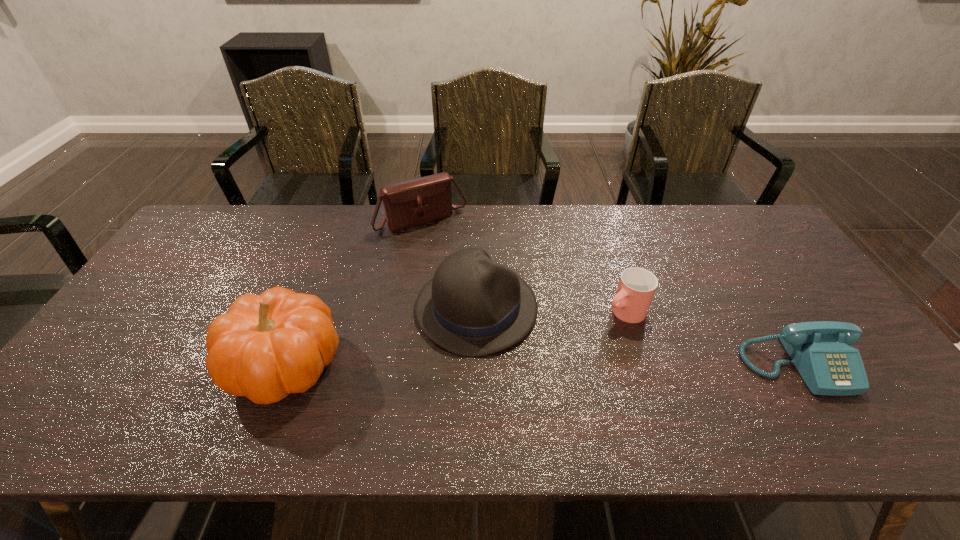
This screenshot has width=960, height=540. Find the location of `object situated at the near right corner`. object situated at the near right corner is located at coordinates (820, 350).

The width and height of the screenshot is (960, 540). I want to click on free region at the far edge of the desktop, so click(251, 225).

The height and width of the screenshot is (540, 960). I want to click on free space at the near edge of the desktop, so pos(577,371).

Where is `vacant space at the left edge of the desktop`? The image size is (960, 540). vacant space at the left edge of the desktop is located at coordinates (174, 259).

This screenshot has width=960, height=540. Identify the location of vacant space at the right edge of the desktop. (788, 274).

Where is `vacant space at the far left corner of the desktop`? The height and width of the screenshot is (540, 960). vacant space at the far left corner of the desktop is located at coordinates (199, 238).

Where is `vacant space at the far right corner of the desktop`? vacant space at the far right corner of the desktop is located at coordinates (736, 227).

This screenshot has height=540, width=960. In order to click on vacant area between the cup and the bowler hat in this screenshot , I will do tap(550, 310).

Find the location of a particular element. This screenshot has height=540, width=960. blank region between the shortest object and the farthest object is located at coordinates (610, 293).

The image size is (960, 540). I want to click on empty location between the bowler hat and the tallest object, so click(381, 336).